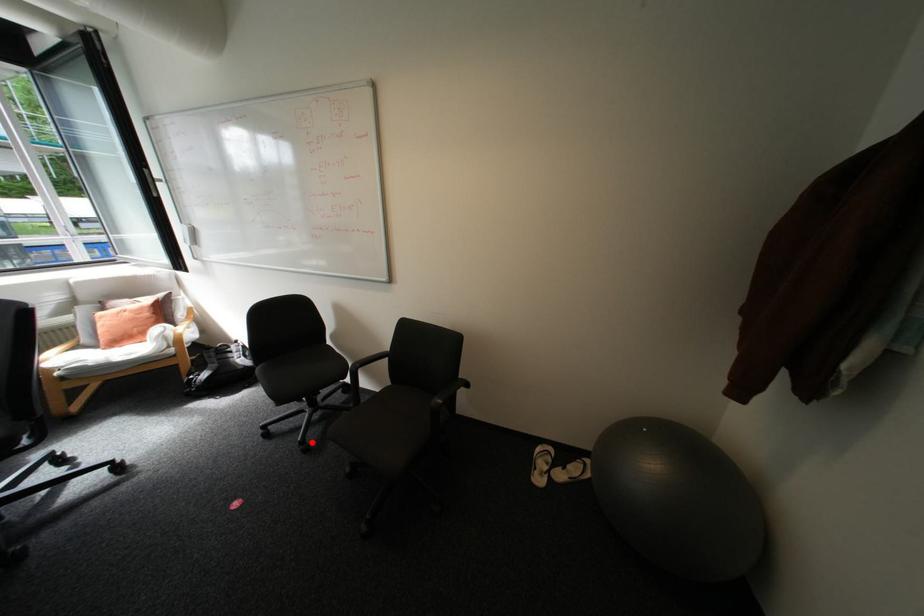
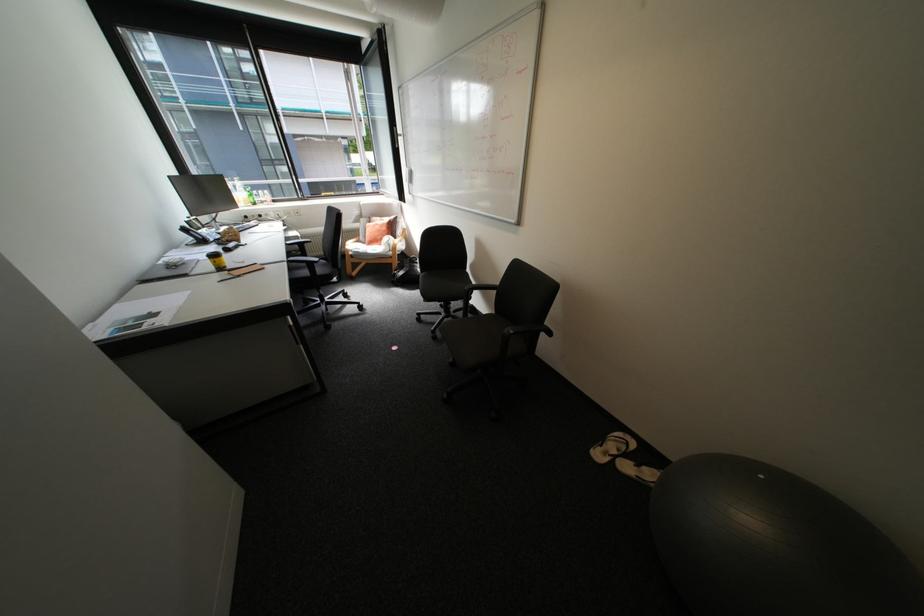
Find the pixel in the second image that matches the highlighted location in the first image.

(444, 331)